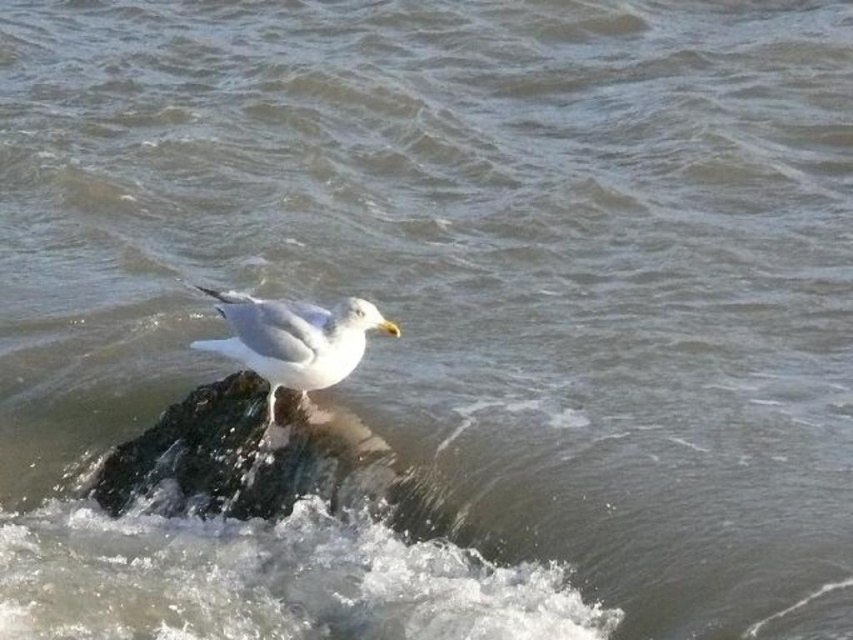
Can you confirm if rough textured rock at center is thinner than white feathered bird at center?

In fact, rough textured rock at center might be wider than white feathered bird at center.

Which is behind, point (144, 480) or point (334, 339)?

The point (144, 480) is more distant.

Identify the location of rough textured rock at center. This screenshot has height=640, width=853. (242, 454).